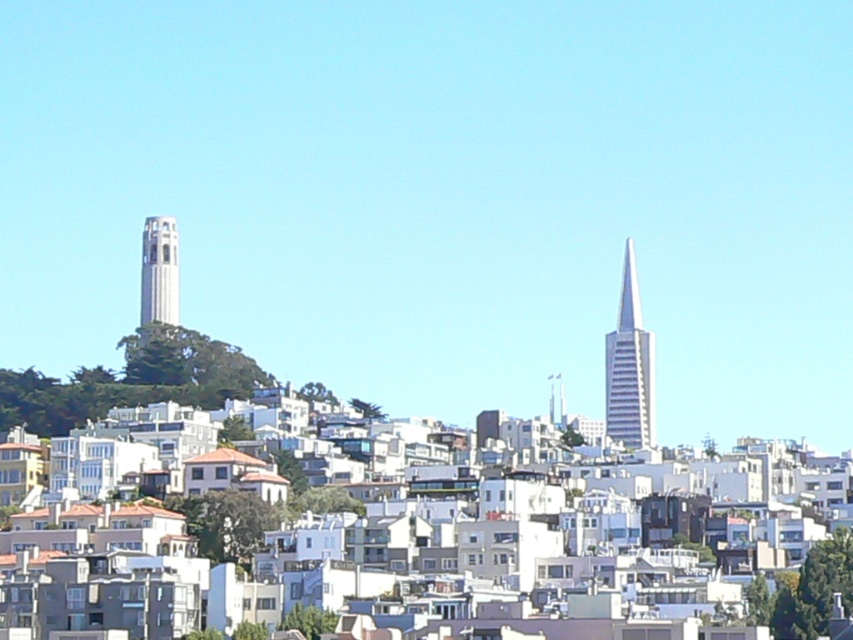
The image size is (853, 640). What do you see at coordinates (630, 368) in the screenshot?
I see `silver glass skyscraper at right` at bounding box center [630, 368].

Does point (627, 352) lie in front of point (151, 284)?

That is False.

At what (x,y) coordinates should I click in order to perform the action: click on silver glass skyscraper at right. Please return your answer as a coordinate pair (x, y). The height and width of the screenshot is (640, 853). Looking at the image, I should click on (630, 368).